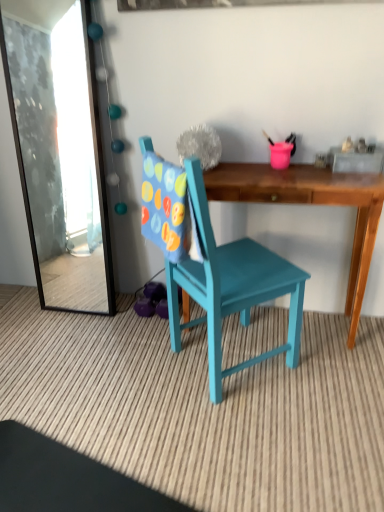
In order to click on free spot above wooden desk at center (from a real-world perspective) in this screenshot , I will do pos(283,167).